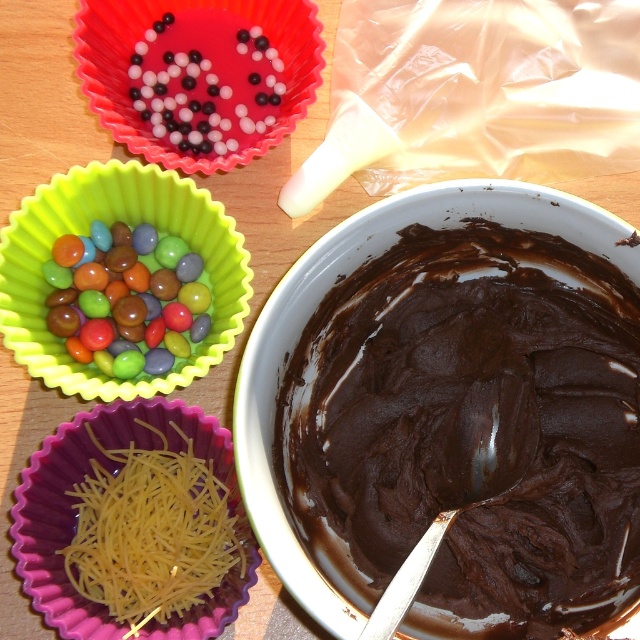
You are standing in the kitchen and see two points in the scene. The first point is at coordinate point(536, 404) and the second is at point(92, 163). Which point is closer to you?

Point(536, 404) is in front of point(92, 163), so it is closer to you.

You are a baker preparing cupcakes and need to place the black glossy beads at upper center onto the dark chocolate paste at center. Can you directly sprinkle them from where they are without moving either object?

The dark chocolate paste at center is closer to the viewer than the black glossy beads at upper center, so you can directly sprinkle them without moving either object because the beads are positioned above the paste.

You are a chef preparing snacks for a party. You have a yellow string cheese at lower left and a colorful glossy candy at upper left on your counter. Which item is closer to you as you stand in front of the counter?

The yellow string cheese at lower left is closer to you because it is in front of the colorful glossy candy at upper left.